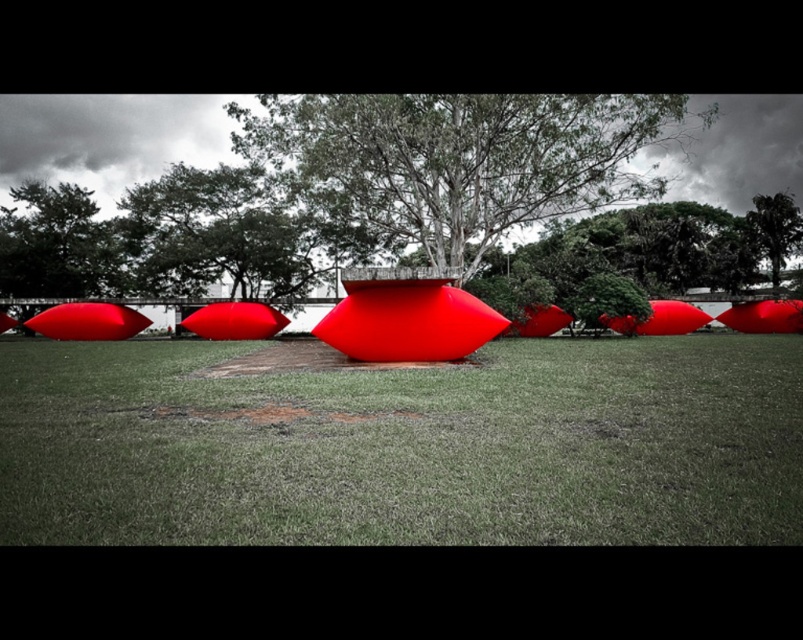
Does matte red object at center have a larger size compared to green leafy tree at center?

Actually, matte red object at center might be smaller than green leafy tree at center.

Where is `matte red object at center`? matte red object at center is located at coordinates (406, 445).

Does point (267, 513) come in front of point (526, 193)?

Yes, it is.

Locate an element on the screen. The height and width of the screenshot is (640, 803). matte red object at center is located at coordinates (406, 445).

Is the position of green leafy tree at center more distant than that of green leafy tree at upper center?

No, it is in front of green leafy tree at upper center.

Does point (658, 99) come closer to viewer compared to point (777, 211)?

Yes, point (658, 99) is closer to viewer.

The image size is (803, 640). What do you see at coordinates (459, 161) in the screenshot?
I see `green leafy tree at center` at bounding box center [459, 161].

Where is `green leafy tree at center`? The height and width of the screenshot is (640, 803). green leafy tree at center is located at coordinates (459, 161).

Does matte red object at center have a greater height compared to green leafy tree at upper center?

In fact, matte red object at center may be shorter than green leafy tree at upper center.

You are a GUI agent. You are given a task and a screenshot of the screen. Output one action in this format:
    pyautogui.click(x=<x>, y=<y>)
    Task: Click on the matte red object at center
    This screenshot has width=803, height=640.
    Given the screenshot: What is the action you would take?
    pyautogui.click(x=406, y=445)

Is point (300, 385) positioned behind point (757, 236)?

No, it is not.

At what (x,y) coordinates should I click in order to perform the action: click on matte red object at center. Please return your answer as a coordinate pair (x, y). The image size is (803, 640). Looking at the image, I should click on (406, 445).